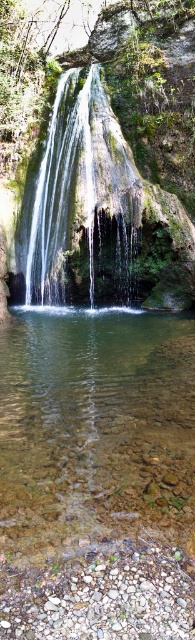
How much distance is there between clear water at center and smooth gray rock at bottom center?

53.44 feet

Where is `clear water at center`? clear water at center is located at coordinates (72, 182).

Between point (73, 189) and point (149, 561), which one is positioned in front?

Positioned in front is point (149, 561).

The width and height of the screenshot is (195, 640). In order to click on clear water at center in this screenshot , I will do `click(72, 182)`.

Does clear glass water at center have a lesser height compared to clear water at center?

Yes, clear glass water at center is shorter than clear water at center.

Identify the location of clear glass water at center. (95, 426).

Which is in front, point (148, 356) or point (33, 180)?

Point (148, 356)

Identify the location of clear glass water at center. coord(95,426).

Does clear glass water at center appear on the right side of smooth gray rock at bottom center?

Correct, you'll find clear glass water at center to the right of smooth gray rock at bottom center.

Who is shorter, clear glass water at center or smooth gray rock at bottom center?

smooth gray rock at bottom center is shorter.

Is point (5, 515) positioned after point (154, 572)?

Yes, point (5, 515) is behind point (154, 572).

Where is `clear glass water at center`? Image resolution: width=195 pixels, height=640 pixels. clear glass water at center is located at coordinates (95, 426).